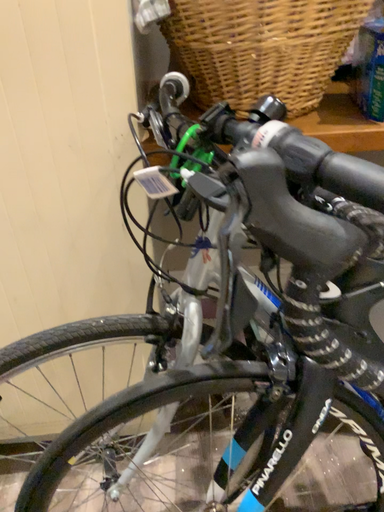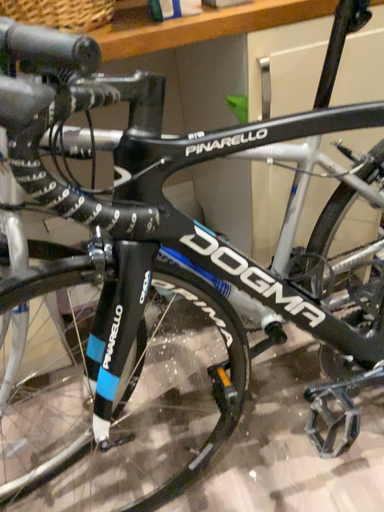
Question: How did the camera likely rotate when shooting the video?

Choices:
 (A) rotated right
 (B) rotated left

Answer: (A)